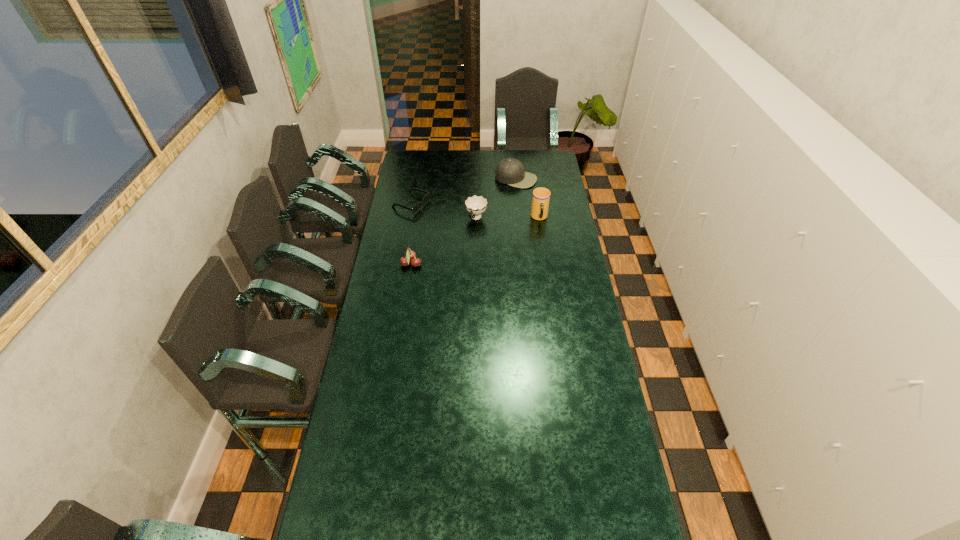
I want to click on sunglasses located at the left edge, so click(426, 198).

Locate an element on the screen. cup positioned at the right edge is located at coordinates (541, 196).

Where is `cap at the right edge`? This screenshot has height=540, width=960. cap at the right edge is located at coordinates (511, 171).

The image size is (960, 540). I want to click on object that is positioned at the far right corner, so click(x=511, y=171).

The height and width of the screenshot is (540, 960). In the image, there is a desktop. Identify the location of free space at the left edge. (375, 466).

This screenshot has height=540, width=960. Identify the location of vacant space at the right edge of the desktop. (612, 428).

Image resolution: width=960 pixels, height=540 pixels. I want to click on free space at the far left corner, so tap(425, 157).

You are a GUI agent. You are given a task and a screenshot of the screen. Output one action in this format:
    pyautogui.click(x=<x>, y=<y>)
    Task: Click on the blank area at the near left corner
    This screenshot has height=540, width=960.
    Given the screenshot: What is the action you would take?
    pyautogui.click(x=354, y=524)

The image size is (960, 540). I want to click on vacant area that lies between the third object from left to right and the shortest object, so click(x=444, y=211).

At what (x,y) coordinates should I click in order to perform the action: click on vacant region between the cherry and the taller cup. Please return your answer as a coordinate pair (x, y). Looking at the image, I should click on (475, 241).